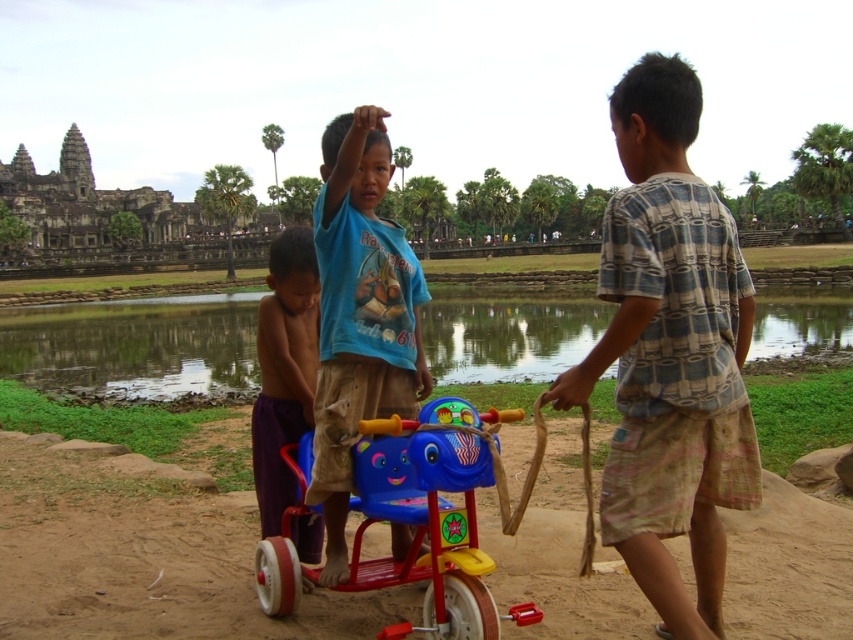
Between blue plastic tricycle at center and purple cotton shorts at lower left, which one has less height?

blue plastic tricycle at center

Based on the photo, is blue plastic tricycle at center further to the viewer compared to purple cotton shorts at lower left?

That is False.

Does point (355, 509) come farther from viewer compared to point (259, 460)?

No, it is not.

In order to click on blue plastic tricycle at center in this screenshot , I will do `click(431, 515)`.

What do you see at coordinates (144, 557) in the screenshot? This screenshot has height=640, width=853. I see `brown dirt field at center` at bounding box center [144, 557].

Is point (134, 600) positioned before point (288, 499)?

Yes, point (134, 600) is in front of point (288, 499).

At what (x,y) coordinates should I click in order to perform the action: click on brown dirt field at center. Please return your answer as a coordinate pair (x, y). This screenshot has width=853, height=640. Looking at the image, I should click on (144, 557).

Which is more to the left, brown dirt field at center or blue cotton shirt at center?

brown dirt field at center is more to the left.

The height and width of the screenshot is (640, 853). What do you see at coordinates (144, 557) in the screenshot?
I see `brown dirt field at center` at bounding box center [144, 557].

Where is `brown dirt field at center`? Image resolution: width=853 pixels, height=640 pixels. brown dirt field at center is located at coordinates [x=144, y=557].